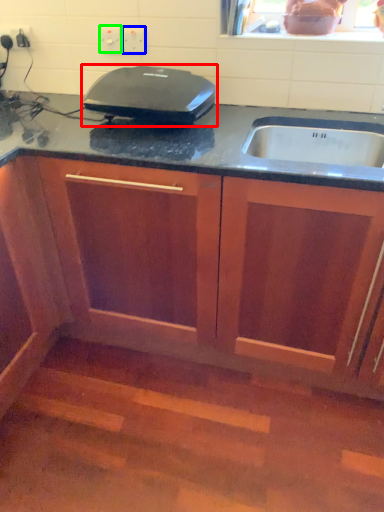
Question: Estimate the real-world distances between objects in this image. Which object is closer to home appliance (highlighted by a red box), electric outlet (highlighted by a blue box) or electric outlet (highlighted by a green box)?

Choices:
 (A) electric outlet
 (B) electric outlet

Answer: (A)